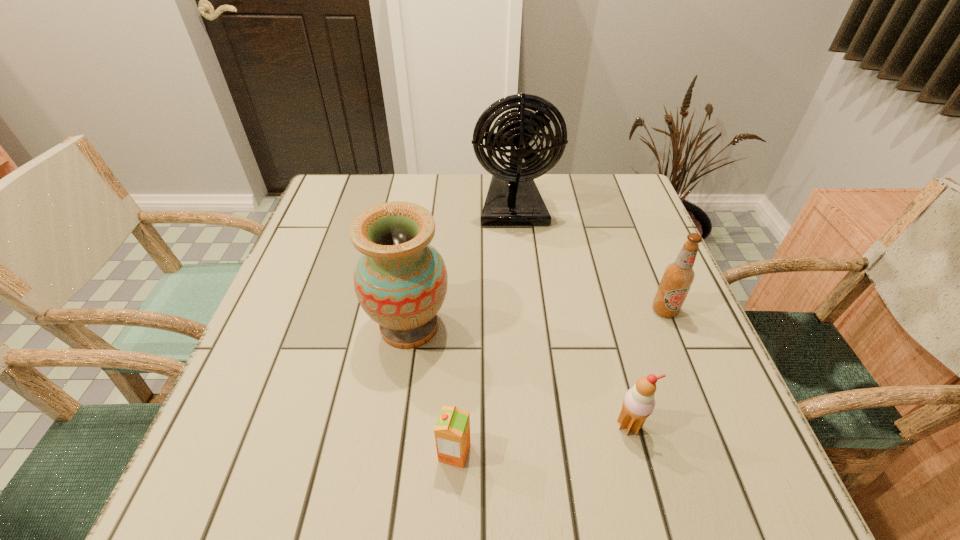
At what (x,y) coordinates should I click in order to perform the action: click on vacant area between the fourth tallest object and the fan. Please return your answer as a coordinate pair (x, y). This screenshot has width=960, height=540. Looking at the image, I should click on (571, 316).

Identify the location of free area in between the orange juice and the fourth shortest object. (432, 389).

Where is `free area in between the icecream and the vase`? This screenshot has width=960, height=540. free area in between the icecream and the vase is located at coordinates (519, 376).

Identify the location of object that is the second nearest to the fan. The height and width of the screenshot is (540, 960). (678, 277).

You are a GUI agent. You are given a task and a screenshot of the screen. Output one action in this format:
    pyautogui.click(x=<x>, y=<y>)
    Task: Click on the third closest object to the fan
    
    Given the screenshot: What is the action you would take?
    639,402